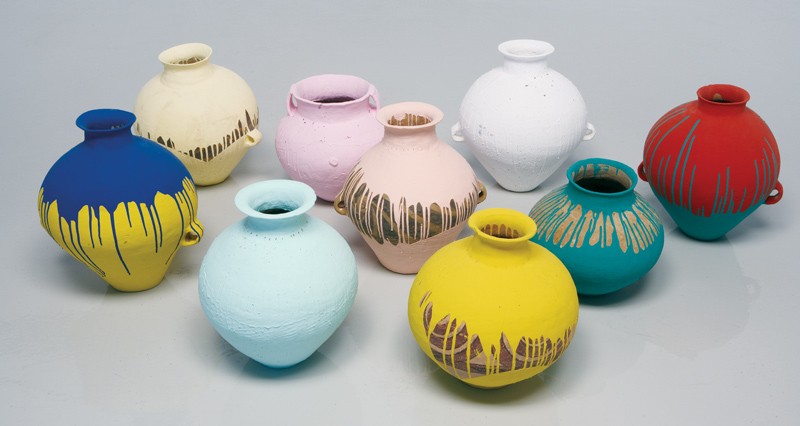
Where is `vase`? The image size is (800, 426). vase is located at coordinates 520,318.